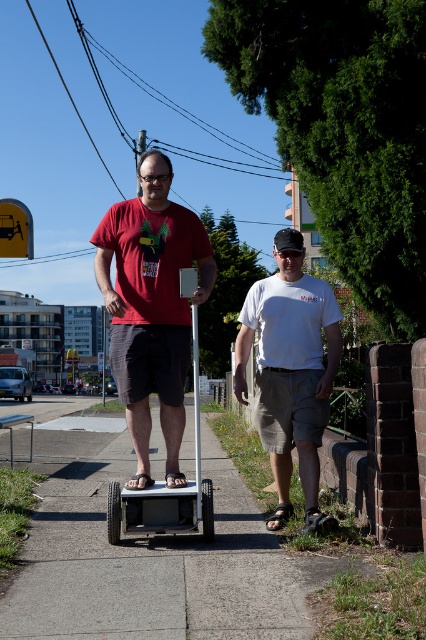
Is concrete at center shorter than matte red t-shirt at center?

Correct, concrete at center is not as tall as matte red t-shirt at center.

Which is more to the right, concrete at center or matte red t-shirt at center?

Positioned to the right is matte red t-shirt at center.

Is point (278, 582) in front of point (143, 301)?

That is True.

Find the location of a particular element. The width and height of the screenshot is (426, 640). concrete at center is located at coordinates (157, 564).

Who is positioned more to the left, white matte shirt at center or white matte scooter at center?

Positioned to the left is white matte scooter at center.

This screenshot has height=640, width=426. What do you see at coordinates (290, 371) in the screenshot?
I see `white matte shirt at center` at bounding box center [290, 371].

What do you see at coordinates (290, 371) in the screenshot?
I see `white matte shirt at center` at bounding box center [290, 371].

At what (x,y) coordinates should I click in order to perform the action: click on white matte shirt at center. Please return your answer as a coordinate pair (x, y). Image resolution: width=426 pixels, height=640 pixels. Looking at the image, I should click on (290, 371).

Is the position of matte red t-shirt at center more distant than that of white matte shirt at center?

No.

Consider the image. Which of these two, matte red t-shirt at center or white matte shirt at center, stands shorter?

Standing shorter between the two is white matte shirt at center.

Who is more forward, (149, 176) or (305, 477)?

Positioned in front is point (149, 176).

The image size is (426, 640). What are the coordinates of `matte red t-shirt at center` in the screenshot? It's located at (152, 307).